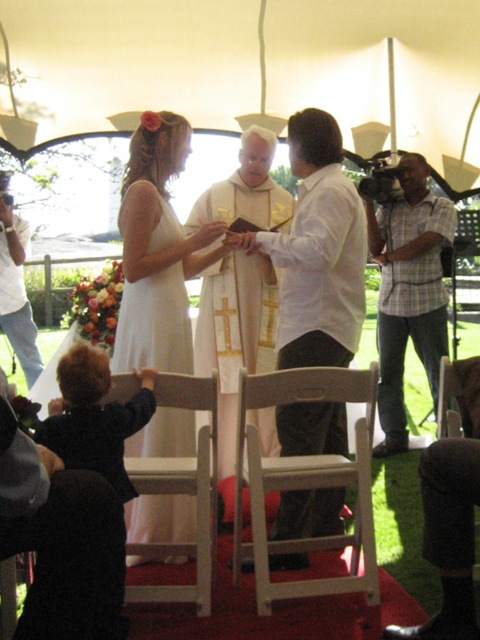
Question: Does white matte shirt at center lie in front of white silk vestment at center?

Choices:
 (A) yes
 (B) no

Answer: (A)

Question: Where is white silk vestment at center located in relation to white satin dress at left in the image?

Choices:
 (A) above
 (B) below

Answer: (B)

Question: Which object appears closest to the camera in this image?

Choices:
 (A) white silk vestment at center
 (B) plaid shirt at right
 (C) white wood chair at lower center
 (D) light wood folding chair at center

Answer: (D)

Question: Considering the real-world distances, which object is closest to the white silk vestment at center?

Choices:
 (A) white cotton shirt at left
 (B) white wood chair at lower center
 (C) dark blue fabric at lower left
 (D) white matte shirt at center

Answer: (D)

Question: Which object is the closest to the white matte shirt at center?

Choices:
 (A) white satin dress at left
 (B) plaid shirt at right

Answer: (A)

Question: Does white matte shirt at center have a greater width compared to white satin dress at left?

Choices:
 (A) yes
 (B) no

Answer: (A)